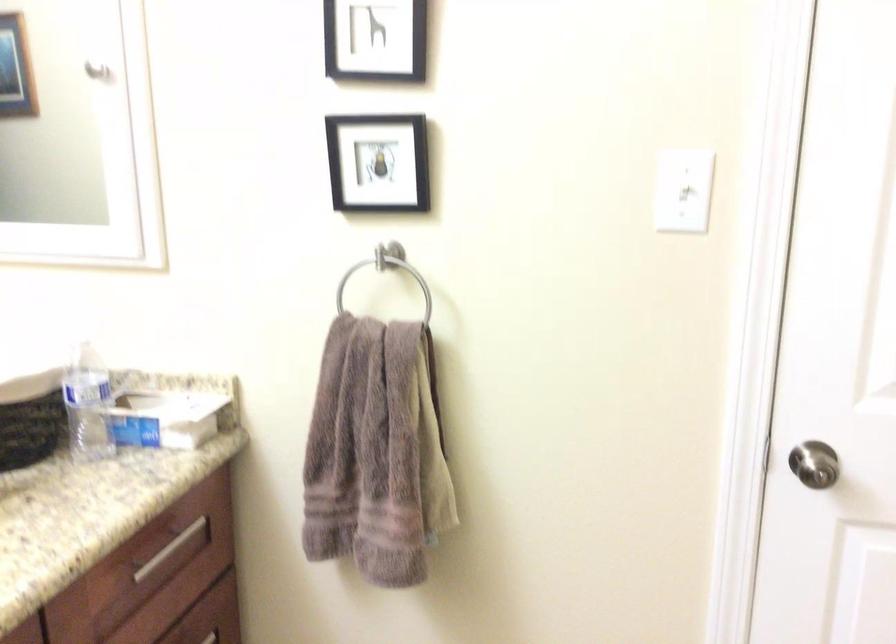
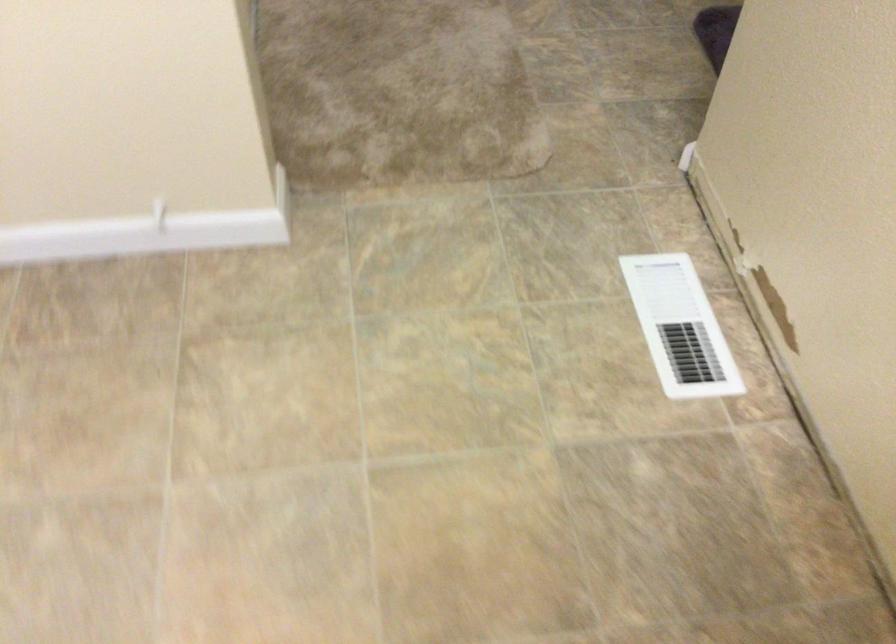
Consider the image. Based on the continuous images, in which direction is the camera rotating?

The rotation direction of the camera is right-down.